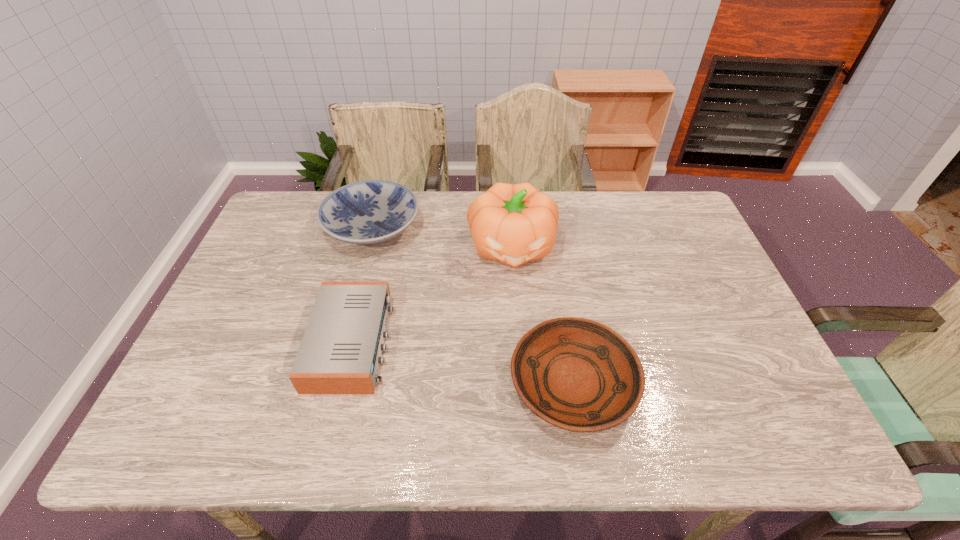
The height and width of the screenshot is (540, 960). I want to click on free spot between the taller plate and the pumpkin, so click(443, 237).

Image resolution: width=960 pixels, height=540 pixels. In order to click on unoccupied area between the second tallest object and the nearer plate in this screenshot , I will do `click(472, 306)`.

Where is `blank region between the taller plate and the pumpkin`? The height and width of the screenshot is (540, 960). blank region between the taller plate and the pumpkin is located at coordinates (443, 237).

Where is `free space between the third shortest object and the nearer plate`? free space between the third shortest object and the nearer plate is located at coordinates (472, 306).

Find the location of `vacant region between the pumpkin and the third shortest object`. vacant region between the pumpkin and the third shortest object is located at coordinates (443, 237).

Identify the location of vacant area that lies between the tallest object and the right plate. (542, 315).

Point out which object is positioned as the nearest to the right plate. Please provide its 2D coordinates. Your answer should be formatted as a tuple, i.e. [(x, y)], where the tuple contains the x and y coordinates of a point satisfying the conditions above.

[(513, 224)]

Locate an element on the screen. Image resolution: width=960 pixels, height=540 pixels. the third closest object to the tallest object is located at coordinates (340, 352).

Identify the location of blank space that satisfies the following two spatial constraints: 1. on the front panel of the right plate; 2. on the right side of the radio receiver. Image resolution: width=960 pixels, height=540 pixels. (342, 383).

You are a GUI agent. You are given a task and a screenshot of the screen. Output one action in this format:
    pyautogui.click(x=<x>, y=<y>)
    Task: Click on the free location that satisfies the following two spatial constraints: 1. on the back side of the shorter plate; 2. on the front panel of the radio receiver
    The width and height of the screenshot is (960, 540).
    Given the screenshot: What is the action you would take?
    pyautogui.click(x=565, y=342)